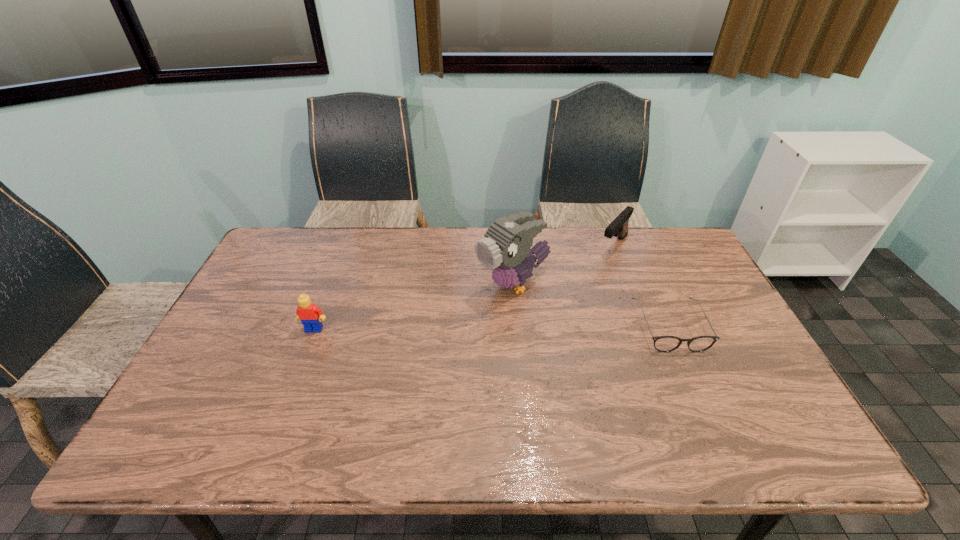
I want to click on free space located at the beak of the bird, so click(x=372, y=366).

Where is `free space located at the beak of the bird`? free space located at the beak of the bird is located at coordinates (455, 317).

Where is `free spot located at the beak of the bird`? The image size is (960, 540). free spot located at the beak of the bird is located at coordinates (420, 337).

Identify the location of pistol located in the far edge section of the desktop. (618, 227).

Where is `bird that is at the far edge`? bird that is at the far edge is located at coordinates (506, 249).

The height and width of the screenshot is (540, 960). Find the location of `object present at the right edge`. object present at the right edge is located at coordinates pos(661,343).

Where is `vacant space at the far edge of the desktop`? This screenshot has height=540, width=960. vacant space at the far edge of the desktop is located at coordinates (358, 254).

At what (x,y) coordinates should I click in order to perform the action: click on vacant space at the near edge of the desktop. Please return your answer as a coordinate pair (x, y). This screenshot has width=960, height=540. Looking at the image, I should click on tap(426, 403).

Find the location of `free space at the left edge`. free space at the left edge is located at coordinates (242, 330).

In the image, there is a desktop. In order to click on vacant space at the right edge in this screenshot , I will do `click(683, 318)`.